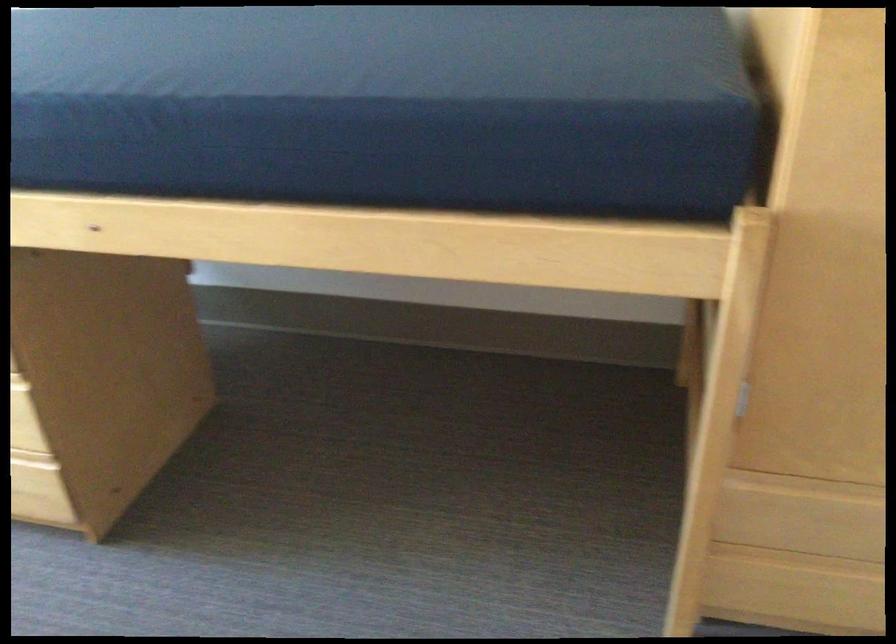
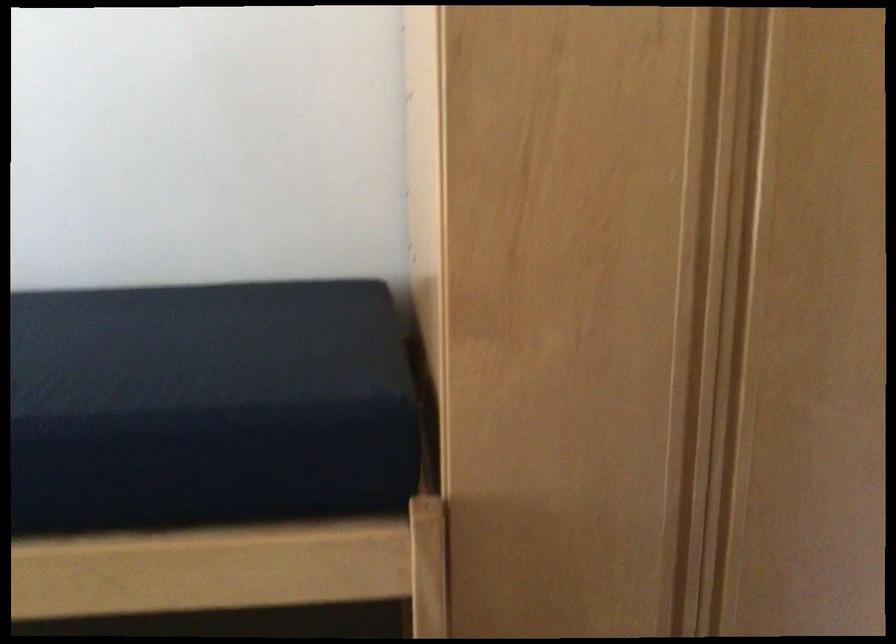
The first image is from the beginning of the video and the second image is from the end. How did the camera likely rotate when shooting the video?

The camera rotated toward right-up.